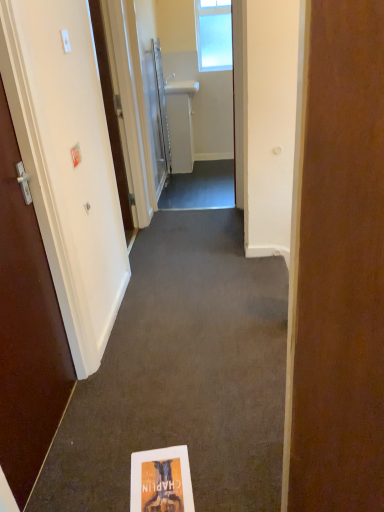
Question: From the image's perspective, is white matte door at left, which appears as the 2th door when viewed from the back, positioned above or below white paper book at center?

Choices:
 (A) below
 (B) above

Answer: (B)

Question: Considering the positions of white matte door at left, arranged as the 3th door when viewed from the front, and white paper book at center in the image, is white matte door at left, arranged as the 3th door when viewed from the front, wider or thinner than white paper book at center?

Choices:
 (A) thin
 (B) wide

Answer: (A)

Question: Estimate the real-world distances between objects in this image. Which object is closer to the matte brown door at left, acting as the 3th door starting from the back?

Choices:
 (A) white glossy sink at center
 (B) clear glass window at upper center
 (C) white paper book at center
 (D) matte paper flyer at lower center
 (E) white glossy towel rack at upper center, which is the 4th door in front-to-back order

Answer: (D)

Question: Which of these objects is positioned closest to the white glossy sink at center?

Choices:
 (A) white glossy sink at upper center
 (B) white glossy door at left, placed as the fourth door when sorted from back to front
 (C) matte paper flyer at lower center
 (D) white paper book at center
 (E) white matte door at left, which appears as the 2th door when viewed from the back

Answer: (A)